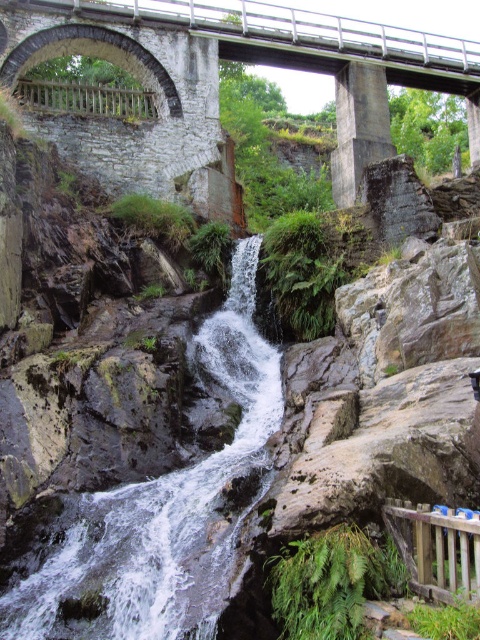
Question: Is white frothy water at center bigger than stone bridge at upper center?

Choices:
 (A) no
 (B) yes

Answer: (A)

Question: Among these points, which one is farthest from the camera?

Choices:
 (A) (194, 353)
 (B) (336, 61)

Answer: (B)

Question: Can you confirm if white frothy water at center is thinner than stone bridge at upper center?

Choices:
 (A) yes
 (B) no

Answer: (A)

Question: Does white frothy water at center have a greater width compared to stone bridge at upper center?

Choices:
 (A) yes
 (B) no

Answer: (B)

Question: Which object appears closest to the camera in this image?

Choices:
 (A) white frothy water at center
 (B) stone bridge at upper center

Answer: (A)